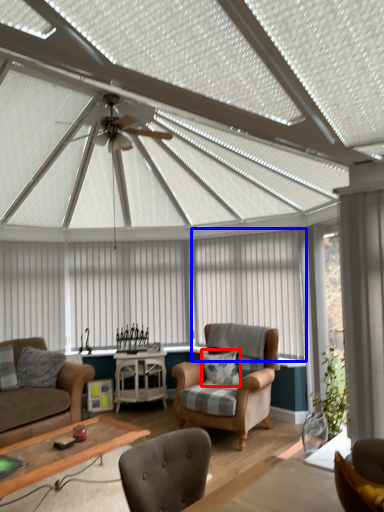
Question: Which object is closer to the camera taking this photo, pillow (highlighted by a red box) or curtain (highlighted by a blue box)?

Choices:
 (A) pillow
 (B) curtain

Answer: (A)